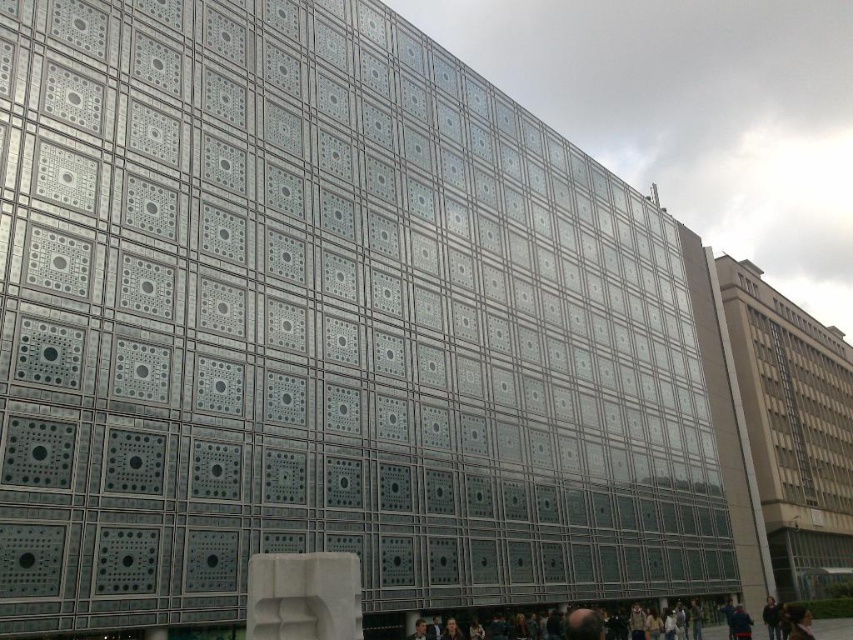
Who is taller, dark brown leather jacket at lower center or dark brown leather jacket at lower right?

dark brown leather jacket at lower center

Is point (548, 632) more distant than point (776, 630)?

No.

Which is in front, point (701, 608) or point (770, 634)?

Positioned in front is point (770, 634).

This screenshot has height=640, width=853. I want to click on dark brown leather jacket at lower center, so click(567, 621).

Is dark blue uniform at lower right taller than dark brown leather jacket at lower right?

In fact, dark blue uniform at lower right may be shorter than dark brown leather jacket at lower right.

Does dark blue uniform at lower right lie behind dark brown leather jacket at lower right?

No.

Is point (747, 620) more distant than point (772, 609)?

No, (747, 620) is in front of (772, 609).

This screenshot has height=640, width=853. I want to click on dark blue uniform at lower right, so click(740, 624).

Who is higher up, dark brown leather jacket at lower center or dark blue uniform at lower right?

dark brown leather jacket at lower center is higher up.

Who is positioned more to the left, dark brown leather jacket at lower center or dark blue uniform at lower right?

dark brown leather jacket at lower center is more to the left.

Between point (790, 609) and point (746, 636), which one is positioned in front?

Positioned in front is point (790, 609).

Where is `dark brown leather jacket at lower center`? The height and width of the screenshot is (640, 853). dark brown leather jacket at lower center is located at coordinates (567, 621).